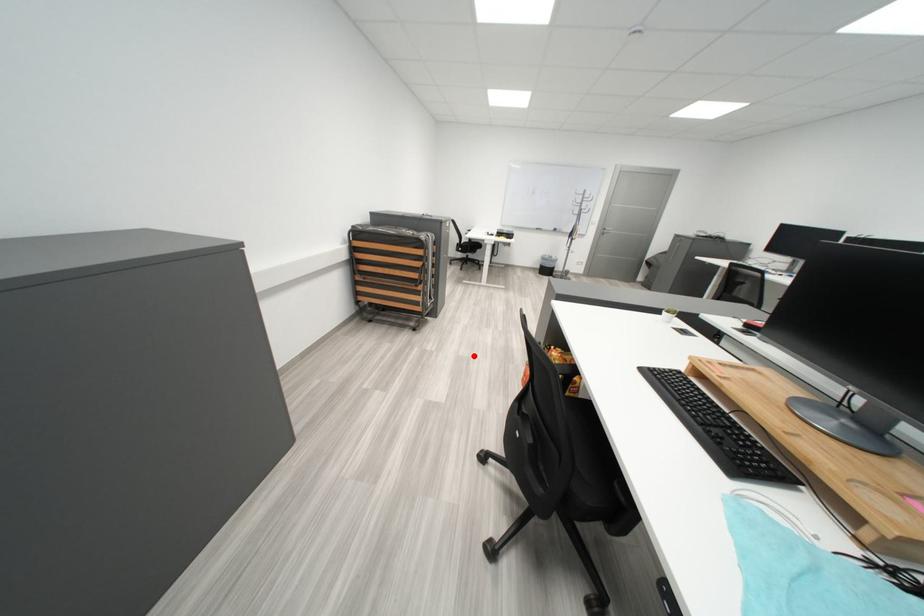
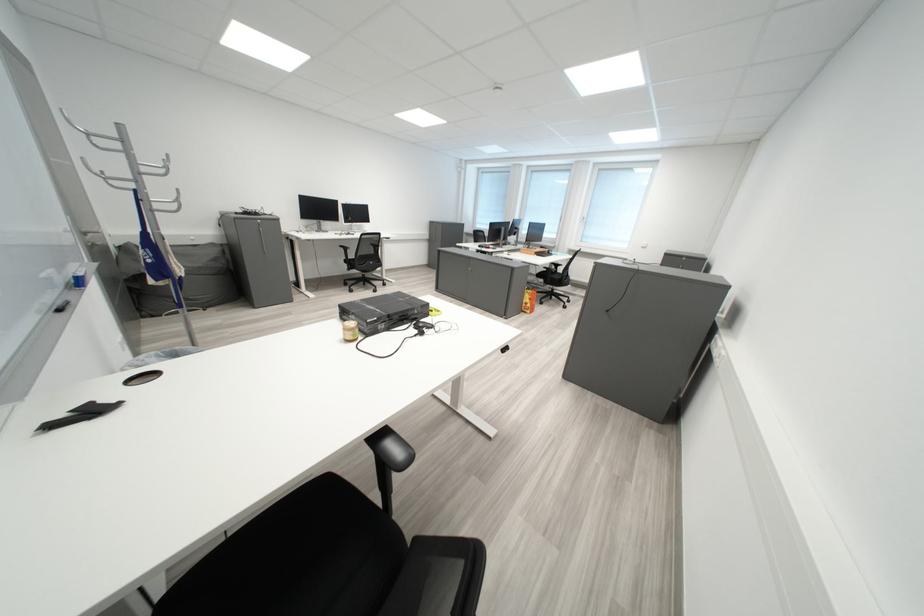
Where in the second image is the point corresponding to the highlighted location from the first image?

(574, 333)